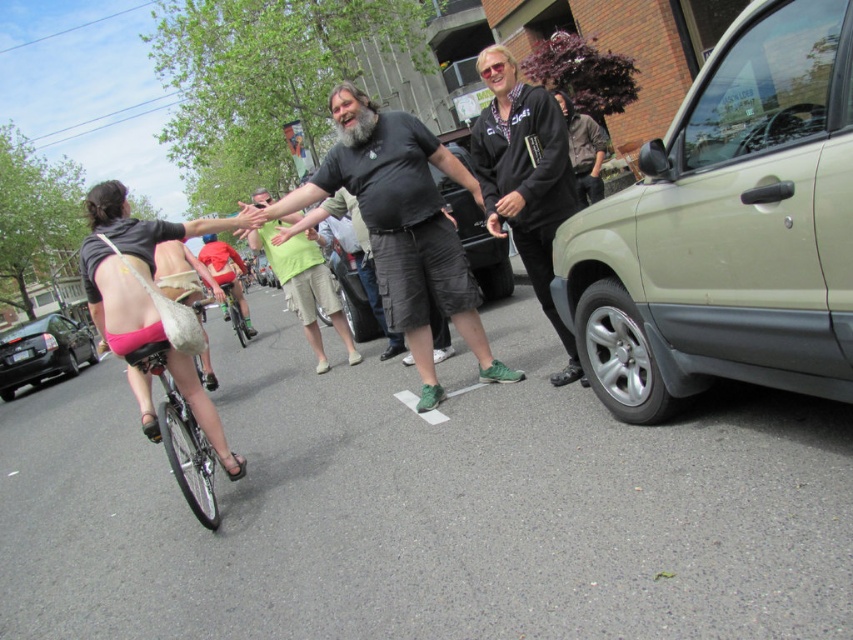
Question: Is green matte suv at right below black fleece jacket at right?

Choices:
 (A) yes
 (B) no

Answer: (A)

Question: Estimate the real-world distances between objects in this image. Which object is farther from the black glossy car at left?

Choices:
 (A) pink matte bicycle at lower left
 (B) dark gray shirt at center
 (C) pink fabric shorts at left

Answer: (C)

Question: Can you confirm if green matte suv at right is positioned above black glossy car at left?

Choices:
 (A) yes
 (B) no

Answer: (A)

Question: Which object is farther from the camera taking this photo?

Choices:
 (A) matte black suv at center
 (B) pink matte bicycle at lower left

Answer: (A)

Question: Which object is positioned farthest from the dark gray shirt at center?

Choices:
 (A) green cotton shirt at center
 (B) dark gray cotton t-shirt at center
 (C) pink matte bicycle at lower left
 (D) black glossy car at left

Answer: (D)

Question: Is green cotton shirt at center positioned in front of green matte bicycle at center?

Choices:
 (A) no
 (B) yes

Answer: (B)